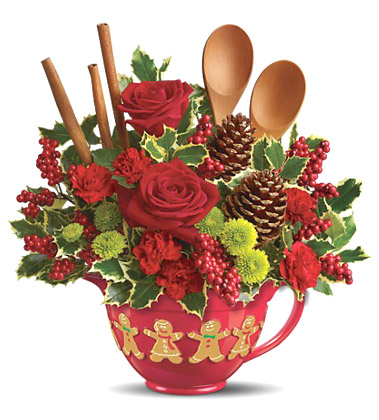
Locate an element on the screen. The height and width of the screenshot is (420, 379). wooden spoon is located at coordinates (274, 114).